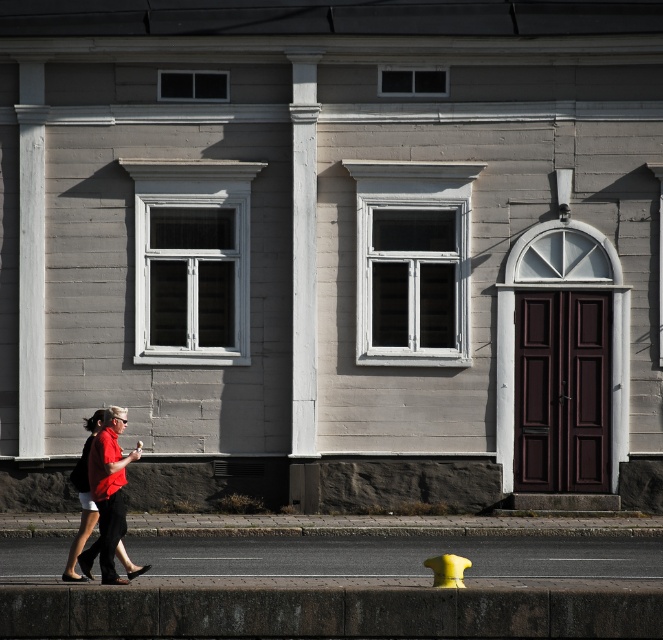
Question: Does matte red shirt at lower left have a greater width compared to yellow rubber hydrant at lower center?

Choices:
 (A) yes
 (B) no

Answer: (A)

Question: Which point is farther from the camera taking this photo?

Choices:
 (A) (365, 552)
 (B) (432, 561)

Answer: (A)

Question: Estimate the real-world distances between objects in this image. Which object is closer to the matte red shirt at lower left?

Choices:
 (A) smooth concrete sidewalk at lower center
 (B) yellow rubber hydrant at lower center

Answer: (B)

Question: Which point is closer to the camera?

Choices:
 (A) yellow rubber hydrant at lower center
 (B) smooth concrete sidewalk at lower center

Answer: (A)

Question: Can you confirm if matte red shirt at lower left is positioned to the right of yellow rubber hydrant at lower center?

Choices:
 (A) no
 (B) yes

Answer: (A)

Question: Does smooth concrete sidewalk at lower center have a greater width compared to matte red shirt at lower left?

Choices:
 (A) no
 (B) yes

Answer: (B)